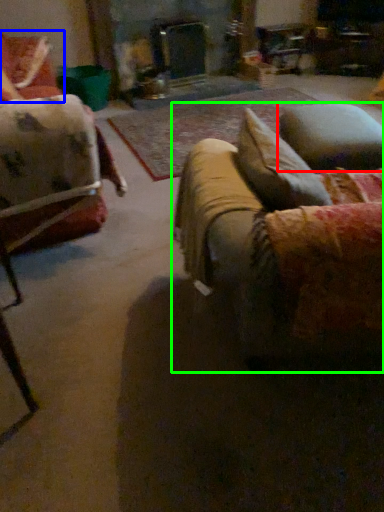
Question: Which is nearer to the pillow (highlighted by a red box)? chair (highlighted by a blue box) or studio couch (highlighted by a green box).

Choices:
 (A) chair
 (B) studio couch

Answer: (B)